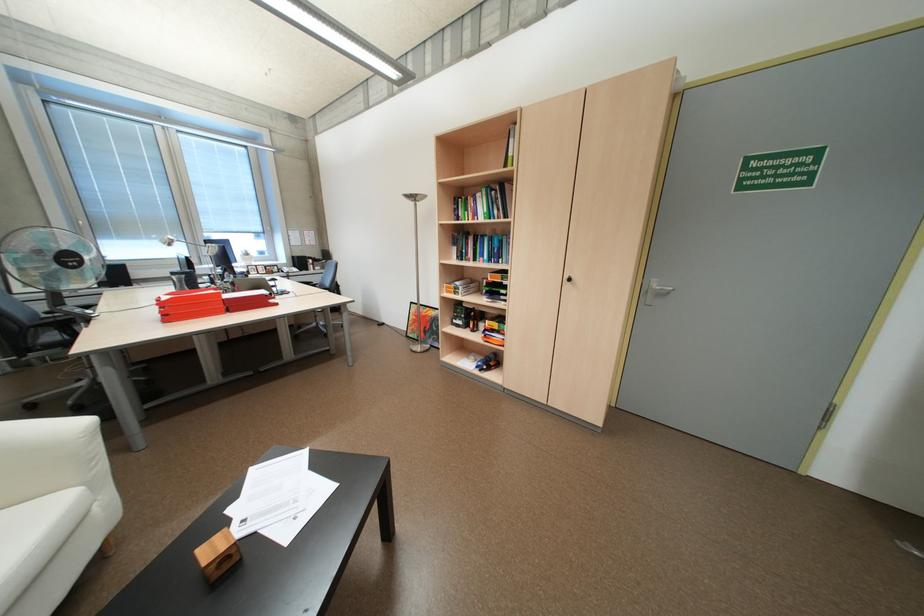
Image resolution: width=924 pixels, height=616 pixels. What do you see at coordinates (567, 278) in the screenshot? I see `a black cabinet knob` at bounding box center [567, 278].